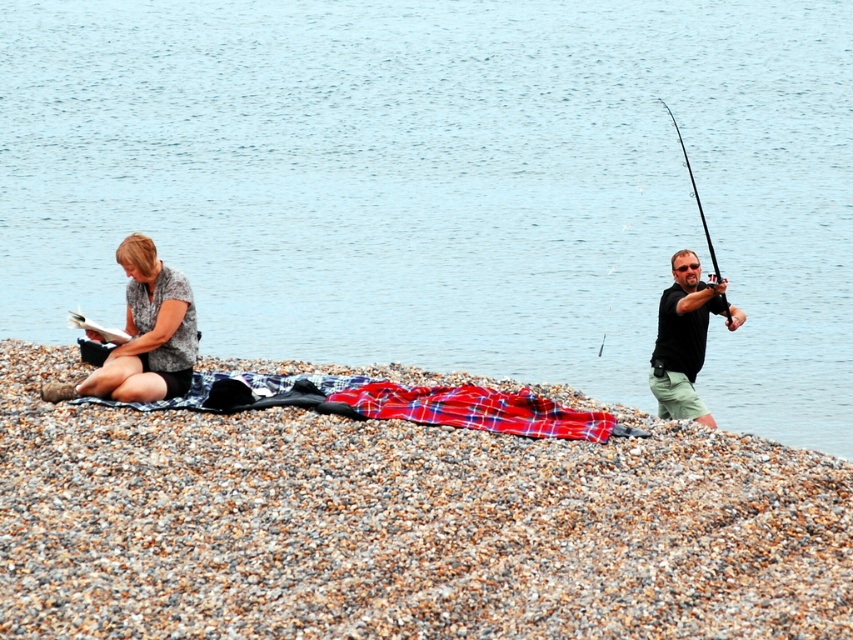
Question: Which of the following is the closest to the observer?

Choices:
 (A) (128, 273)
 (B) (299, 417)
 (C) (734, 328)

Answer: (B)

Question: Does blue water at center have a greater width compared to black plastic rod at right?

Choices:
 (A) no
 (B) yes

Answer: (B)

Question: In this image, where is blue water at center located relative to matte gray shirt at left?

Choices:
 (A) left
 (B) right

Answer: (B)

Question: Can you confirm if black matte shirt at right is thinner than black plastic rod at right?

Choices:
 (A) yes
 (B) no

Answer: (A)

Question: Which object is closer to the camera taking this photo?

Choices:
 (A) smooth pebbles at lower left
 (B) matte gray shirt at left

Answer: (A)

Question: Among these objects, which one is farthest from the camera?

Choices:
 (A) matte gray shirt at left
 (B) black matte shirt at right
 (C) smooth pebbles at lower left
 (D) blue water at center

Answer: (B)